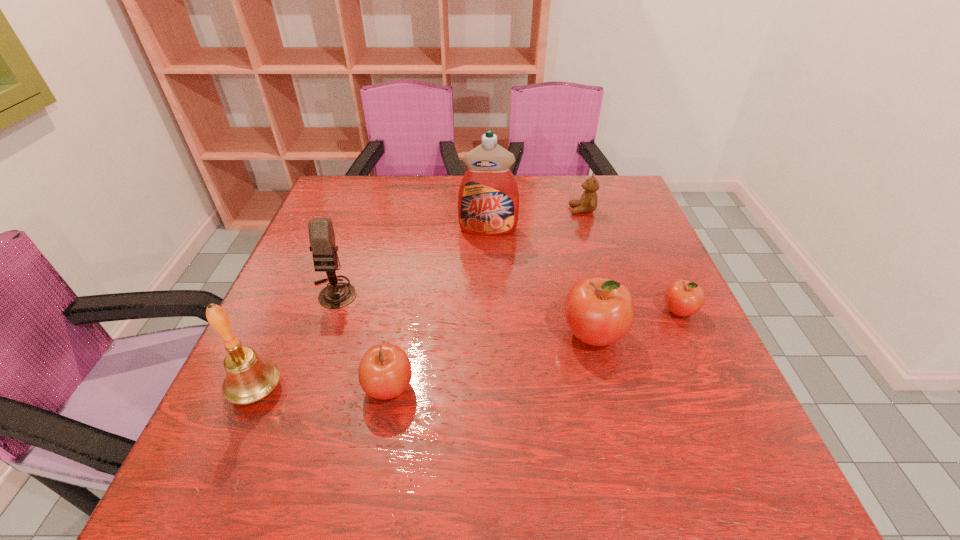
If the aim is uniform spacing by inserting an additional apple among them, please point to a vacant space for this new apple. Please provide its 2D coordinates. Your answer should be formatted as a tuple, i.e. [(x, y)], where the tuple contains the x and y coordinates of a point satisfying the conditions above.

[(496, 359)]